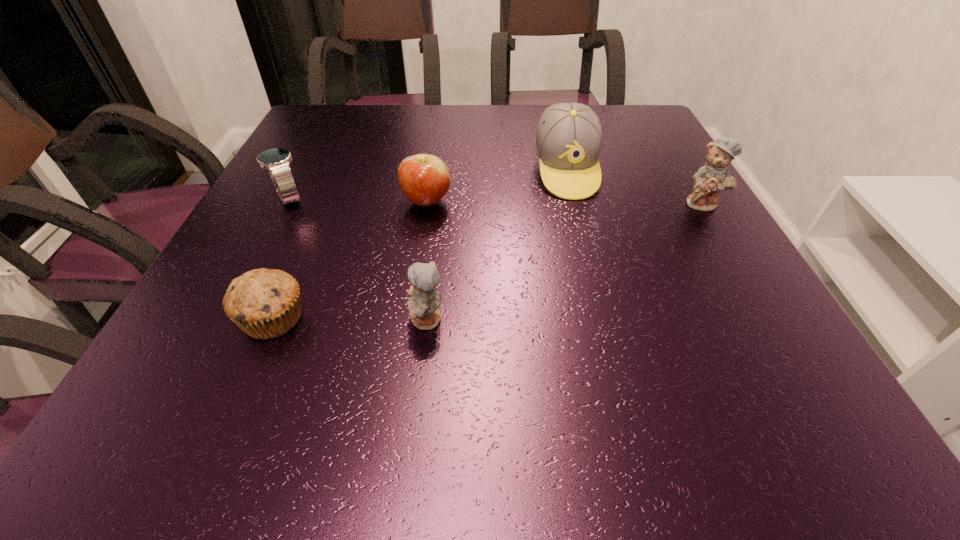
Find the location of a particular element. Image resolution: width=960 pixels, height=540 pixels. object identified as the third closest to the farther teddy bear is located at coordinates (423, 305).